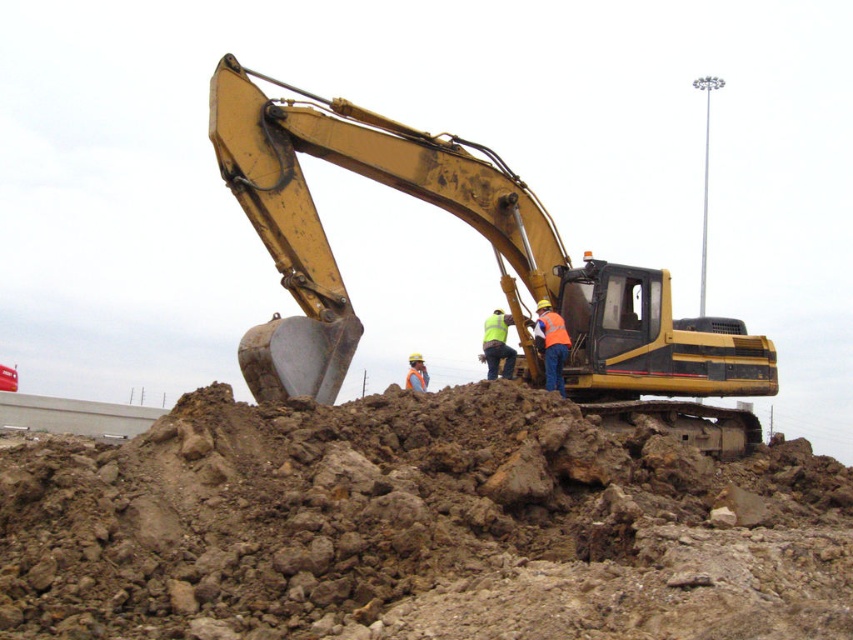
Question: Which point is closer to the camera taking this photo?

Choices:
 (A) (563, 547)
 (B) (294, 208)

Answer: (A)

Question: Which point is farther to the camera?

Choices:
 (A) (366, 506)
 (B) (611, 372)

Answer: (B)

Question: Observing the image, what is the correct spatial positioning of brown rocky dirt at center in reference to yellow metallic excavator at center?

Choices:
 (A) below
 (B) above

Answer: (A)

Question: Which point is closer to the camera?

Choices:
 (A) brown rocky dirt at center
 (B) yellow metallic excavator at center

Answer: (A)

Question: Does brown rocky dirt at center have a smaller size compared to yellow metallic excavator at center?

Choices:
 (A) no
 (B) yes

Answer: (A)

Question: Does brown rocky dirt at center appear on the right side of yellow metallic excavator at center?

Choices:
 (A) no
 (B) yes

Answer: (A)